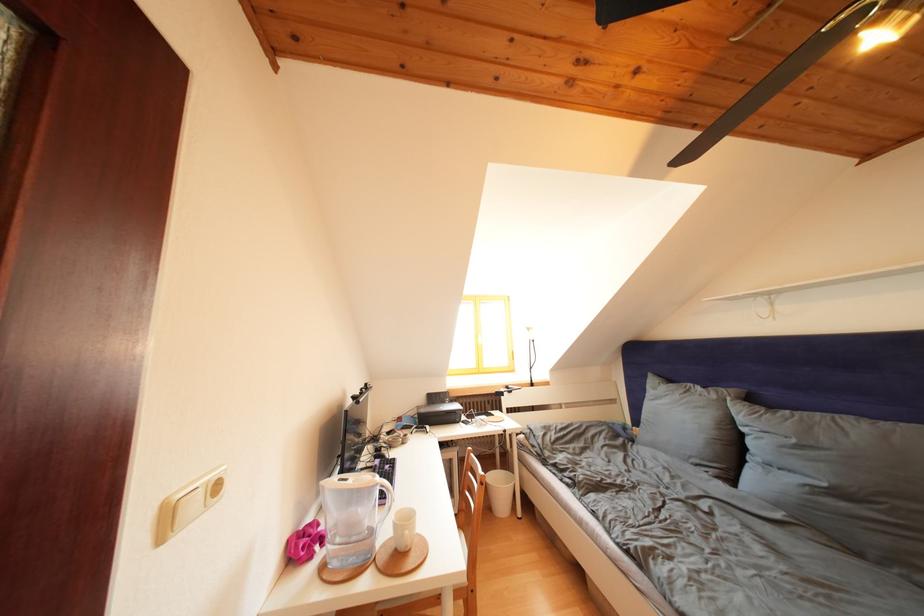
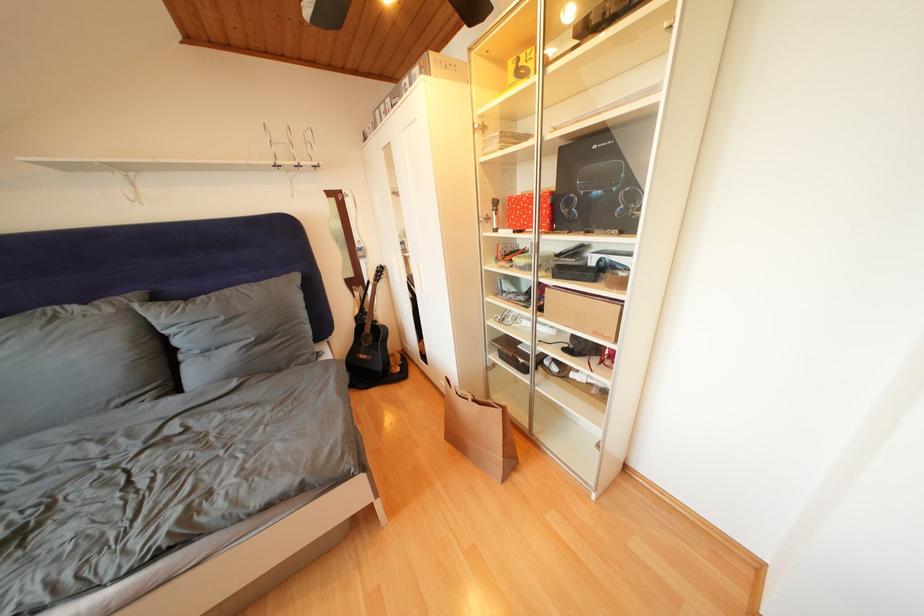
The first image is from the beginning of the video and the second image is from the end. How did the camera likely rotate when shooting the video?

The camera's rotation is toward right-down.